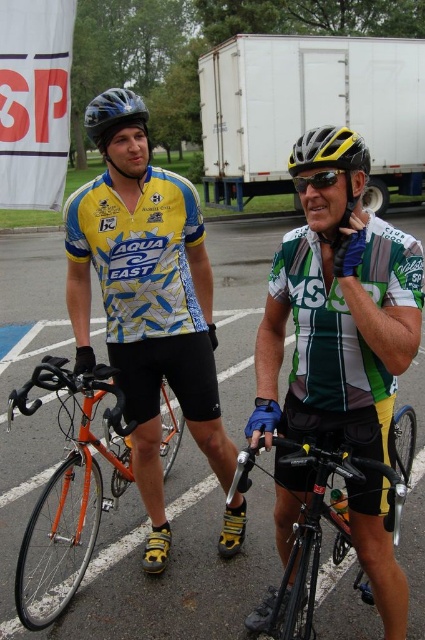
Who is positioned more to the right, white matte trailer truck at upper center or yellow and black helmet at center?

white matte trailer truck at upper center is more to the right.

Does white matte trailer truck at upper center have a larger size compared to yellow and black helmet at center?

Yes.

Between point (373, 90) and point (345, 140), which one is positioned behind?

Positioned behind is point (373, 90).

This screenshot has width=425, height=640. I want to click on white matte trailer truck at upper center, so click(x=309, y=109).

This screenshot has width=425, height=640. I want to click on yellow matte helmet at center, so click(x=329, y=157).

Can you confirm if yellow matte helmet at center is positioned below matte black helmet at upper left?

Indeed, yellow matte helmet at center is positioned under matte black helmet at upper left.

Does point (328, 138) lie in front of point (138, 115)?

Yes.

The width and height of the screenshot is (425, 640). In order to click on yellow matte helmet at center in this screenshot , I will do `click(329, 157)`.

Consider the image. Is green and white jersey at center wider than matte black helmet at upper left?

No, green and white jersey at center is not wider than matte black helmet at upper left.

Does point (391, 589) come farther from viewer compared to point (102, 102)?

That is False.

Describe the element at coordinates (339, 323) in the screenshot. I see `green and white jersey at center` at that location.

Identify the location of green and white jersey at center. This screenshot has width=425, height=640. (339, 323).